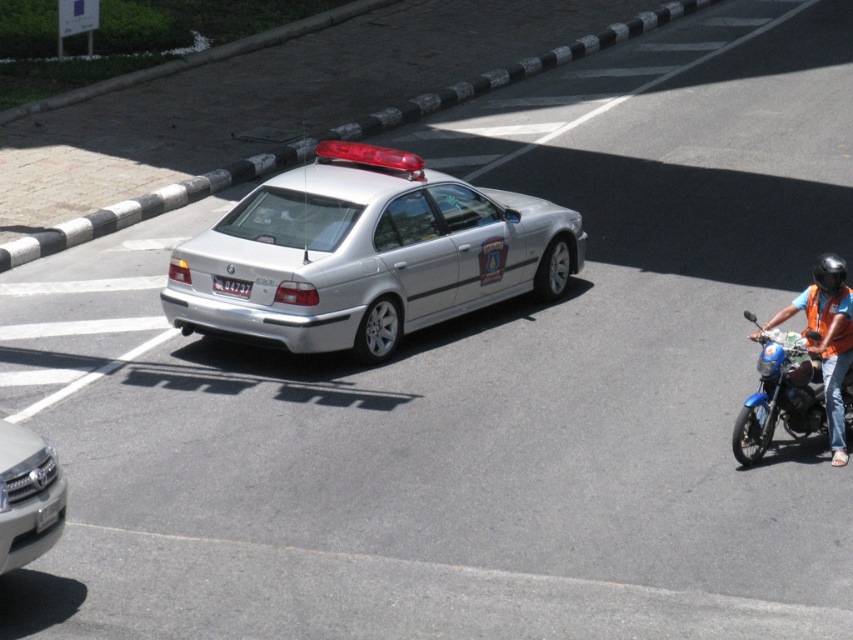
You are a pedestrian standing at the crosswalk. You see the orange reflective vest at right and the black plastic license plate at center. If you want to cross the road safely, which object should you pay attention to first?

You should pay attention to the orange reflective vest at right first because it is closer to you than the black plastic license plate at center. The distance between them is 14.38 feet, so the vest is nearer and poses an immediate hazard.

You are a pedestrian standing on the sidewalk observing the scene. You notice the orange reflective vest at right and the black plastic license plate at center. Which object is positioned closer to you?

The orange reflective vest at right is closer to the viewer than the black plastic license plate at center.

You are a pedestrian standing on the sidewalk. You see the satin silver grille at lower left and the black plastic license plate at center on the police car. If you want to cross the road safely, which object should you wait until it passes first?

You should wait until the satin silver grille at lower left passes first because it is closer to you than the black plastic license plate at center. Since the police car is moving away from you, the front grille will pass by you before the rear license plate.